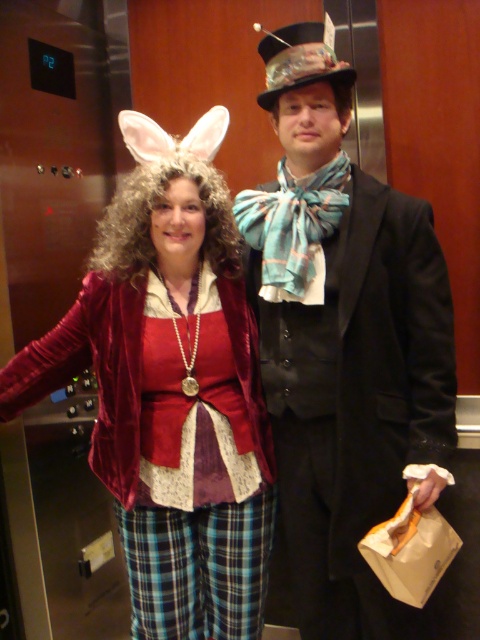
Question: Is shiny black suit at center further to camera compared to velvet red jacket at center?

Choices:
 (A) yes
 (B) no

Answer: (B)

Question: Is shiny black suit at center closer to camera compared to velvet red jacket at center?

Choices:
 (A) yes
 (B) no

Answer: (A)

Question: Where is shiny black suit at center located in relation to velvet red jacket at center in the image?

Choices:
 (A) right
 (B) left

Answer: (A)

Question: Which object appears closest to the camera in this image?

Choices:
 (A) velvet red jacket at center
 (B) shiny black suit at center

Answer: (B)

Question: Which point is farther to the camera?

Choices:
 (A) velvet red jacket at center
 (B) shiny black suit at center

Answer: (A)